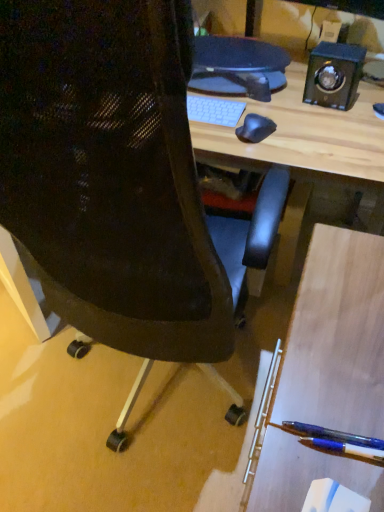
Question: Is blue glossy pen at lower right shorter than black polished wood speaker at upper right?

Choices:
 (A) no
 (B) yes

Answer: (B)

Question: Could you tell me if blue glossy pen at lower right is turned towards black polished wood speaker at upper right?

Choices:
 (A) yes
 (B) no

Answer: (B)

Question: Is blue glossy pen at lower right positioned with its back to black polished wood speaker at upper right?

Choices:
 (A) yes
 (B) no

Answer: (B)

Question: Does blue glossy pen at lower right come behind black polished wood speaker at upper right?

Choices:
 (A) no
 (B) yes

Answer: (A)

Question: Can you confirm if blue glossy pen at lower right is taller than black polished wood speaker at upper right?

Choices:
 (A) no
 (B) yes

Answer: (A)

Question: Considering the relative sizes of blue glossy pen at lower right and black polished wood speaker at upper right in the image provided, is blue glossy pen at lower right bigger than black polished wood speaker at upper right?

Choices:
 (A) yes
 (B) no

Answer: (B)

Question: Is translucent blue pen at lower right wider than black mesh chair at center?

Choices:
 (A) no
 (B) yes

Answer: (A)

Question: Does translucent blue pen at lower right have a greater height compared to black mesh chair at center?

Choices:
 (A) no
 (B) yes

Answer: (A)

Question: Considering the relative positions of translucent blue pen at lower right and black mesh chair at center in the image provided, is translucent blue pen at lower right to the right of black mesh chair at center from the viewer's perspective?

Choices:
 (A) yes
 (B) no

Answer: (A)

Question: Is translucent blue pen at lower right not within black mesh chair at center?

Choices:
 (A) no
 (B) yes

Answer: (B)

Question: From the image's perspective, does translucent blue pen at lower right appear higher than black mesh chair at center?

Choices:
 (A) yes
 (B) no

Answer: (B)

Question: Can you confirm if translucent blue pen at lower right is smaller than black mesh chair at center?

Choices:
 (A) no
 (B) yes

Answer: (B)

Question: Is black mesh chair at center at the back of blue glossy pen at lower right?

Choices:
 (A) no
 (B) yes

Answer: (A)